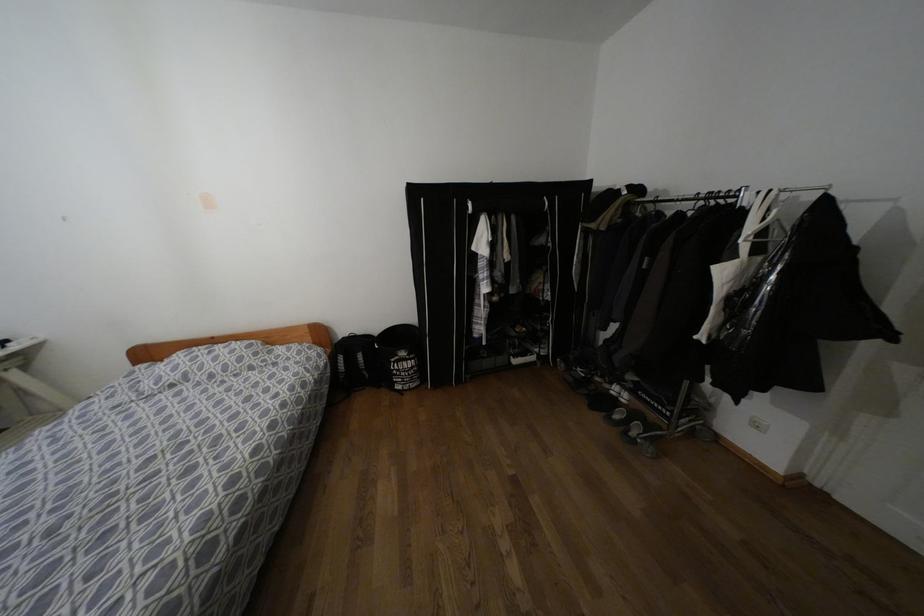
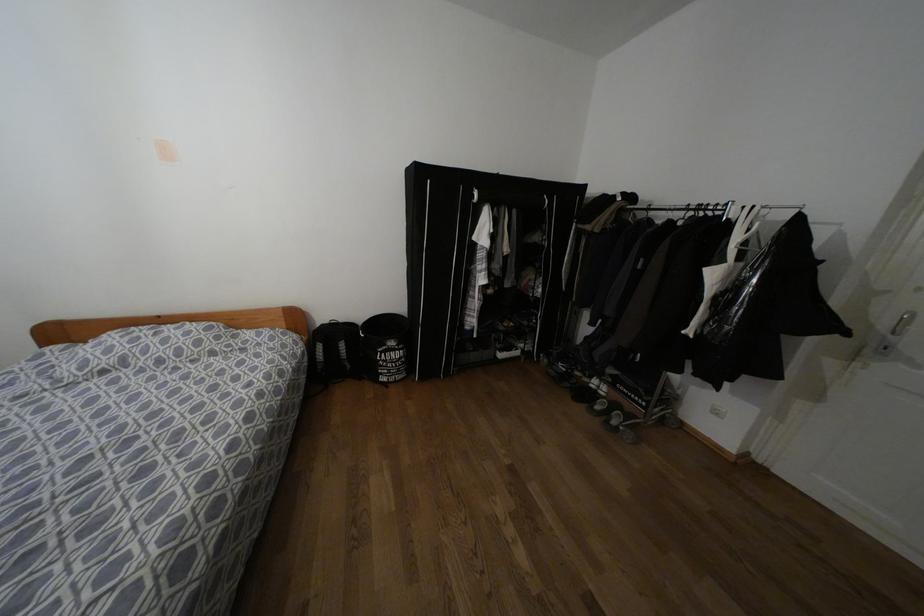
Where in the second image is the point corresponding to (402,353) from the first image?

(391, 342)